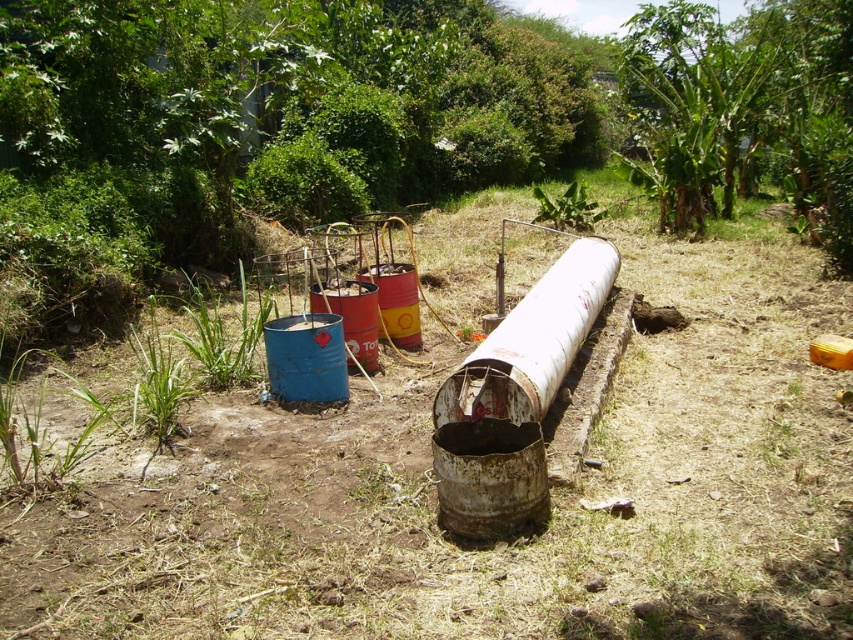
Is green grass at center to the left of green grass at lower left from the viewer's perspective?

Indeed, green grass at center is positioned on the left side of green grass at lower left.

Between green grass at center and green grass at lower left, which one appears on the right side from the viewer's perspective?

green grass at lower left is more to the right.

Does point (780, 570) lie in front of point (245, 314)?

Yes, it is in front of point (245, 314).

You are a GUI agent. You are given a task and a screenshot of the screen. Output one action in this format:
    pyautogui.click(x=<x>, y=<y>)
    Task: Click on the green grass at center
    This screenshot has width=853, height=640.
    Given the screenshot: What is the action you would take?
    pyautogui.click(x=500, y=541)